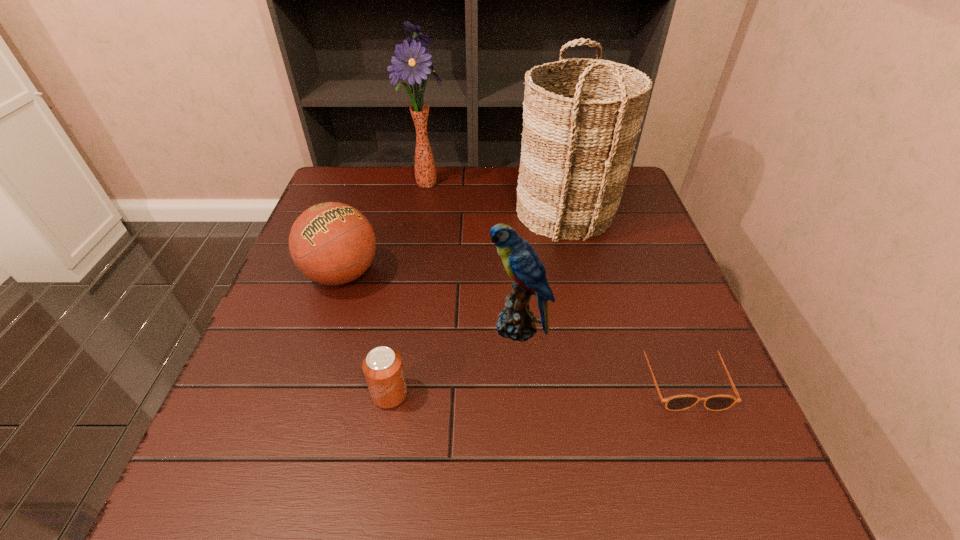
Where is `flower arrangement`? This screenshot has height=540, width=960. flower arrangement is located at coordinates (410, 63).

Find the location of a particular element. This screenshot has width=960, height=540. basket is located at coordinates (580, 124).

The width and height of the screenshot is (960, 540). Find the location of `the fourth farthest object`. the fourth farthest object is located at coordinates (520, 260).

Locate an element on the screen. the fourth shortest object is located at coordinates (520, 260).

This screenshot has height=540, width=960. What are the coordinates of `the fourth tallest object` in the screenshot? It's located at (332, 243).

Where is `basketball`? basketball is located at coordinates (332, 243).

Identify the location of can. pos(382,367).

The width and height of the screenshot is (960, 540). In order to click on sunglasses in this screenshot , I will do `click(678, 402)`.

Locate an element on the screen. This screenshot has width=960, height=540. vacant area located on the left of the flower arrangement is located at coordinates (375, 183).

The height and width of the screenshot is (540, 960). I want to click on vacant space located on the front of the basket, so pos(590,312).